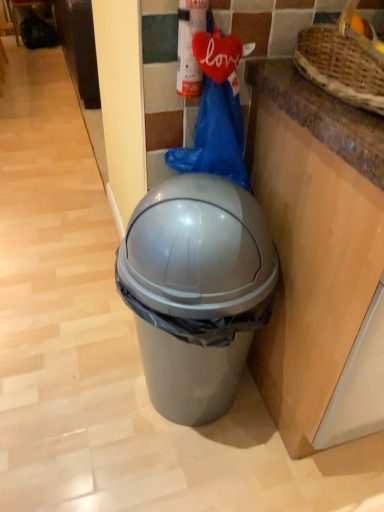
Question: From a real-world perspective, relative to metallic silver extinguisher at upper center, is matte gray trash can at center vertically above or below?

Choices:
 (A) above
 (B) below

Answer: (B)

Question: Considering the positions of matte gray trash can at center and metallic silver extinguisher at upper center in the image, is matte gray trash can at center taller or shorter than metallic silver extinguisher at upper center?

Choices:
 (A) short
 (B) tall

Answer: (B)

Question: Which is nearer to the brown woven basket at upper right?

Choices:
 (A) matte gray trash can at center
 (B) metallic silver extinguisher at upper center

Answer: (B)

Question: Based on their relative distances, which object is nearer to the brown woven basket at upper right?

Choices:
 (A) metallic silver extinguisher at upper center
 (B) matte gray trash can at center

Answer: (A)